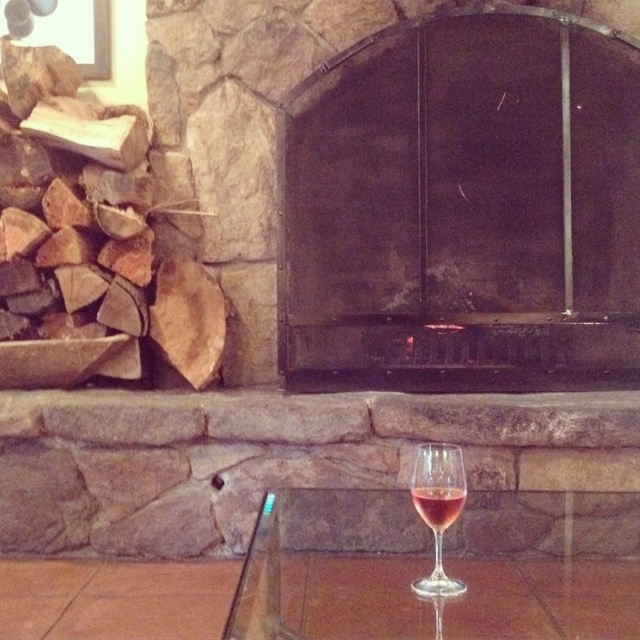
Does transparent glass table at lower center have a larger size compared to rosy glass at lower center?

Yes, transparent glass table at lower center is bigger than rosy glass at lower center.

Who is taller, transparent glass table at lower center or rosy glass at lower center?

With more height is rosy glass at lower center.

The image size is (640, 640). What do you see at coordinates (545, 564) in the screenshot? I see `transparent glass table at lower center` at bounding box center [545, 564].

Locate an element on the screen. transparent glass table at lower center is located at coordinates (545, 564).

Image resolution: width=640 pixels, height=640 pixels. What do you see at coordinates (465, 211) in the screenshot?
I see `dark stone fireplace at center` at bounding box center [465, 211].

What do you see at coordinates (465, 211) in the screenshot?
I see `dark stone fireplace at center` at bounding box center [465, 211].

I want to click on dark stone fireplace at center, so click(x=465, y=211).

At what (x,y) coordinates should I click in order to perform the action: click on transparent glass table at lower center. Please return your answer as a coordinate pair (x, y). Image resolution: width=640 pixels, height=640 pixels. Looking at the image, I should click on (545, 564).

Where is `transparent glass table at lower center`? The height and width of the screenshot is (640, 640). transparent glass table at lower center is located at coordinates (545, 564).